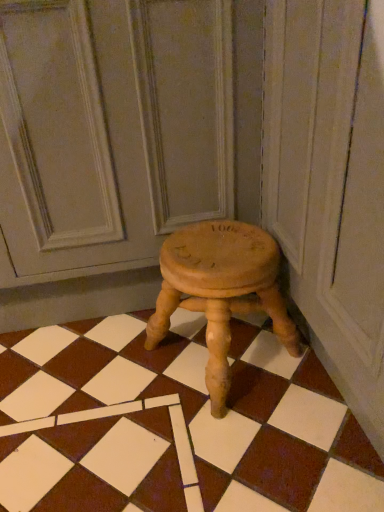
Where is `vacant area situated to the left side of wooden stool at center`? Image resolution: width=384 pixels, height=512 pixels. vacant area situated to the left side of wooden stool at center is located at coordinates (91, 372).